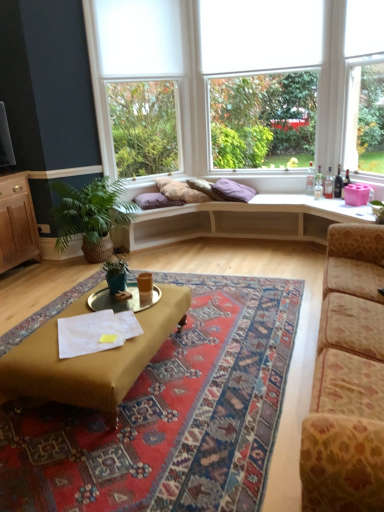
Question: Based on their sizes in the image, would you say green leafy plant at left, the first houseplant in the back-to-front sequence, is bigger or smaller than leopard print fabric couch at right?

Choices:
 (A) big
 (B) small

Answer: (B)

Question: Considering the positions of green leafy plant at left, which is counted as the 2th houseplant, starting from the front, and leopard print fabric couch at right in the image, is green leafy plant at left, which is counted as the 2th houseplant, starting from the front, wider or thinner than leopard print fabric couch at right?

Choices:
 (A) thin
 (B) wide

Answer: (B)

Question: Which is farther from the purple cotton pillow at center, which is the 2th pillow from left to right?

Choices:
 (A) carpeted rug at center
 (B) mustard fabric coffee table at center
 (C) leopard print fabric couch at right
 (D) metallic gold cocktail table at center
 (E) green matte plant at center, which is the 2th houseplant in back-to-front order

Answer: (B)

Question: Based on their relative distances, which object is nearer to the green leafy plant at left, which is counted as the 2th houseplant, starting from the front?

Choices:
 (A) white fabric blind at upper center
 (B) light wood futon at center
 (C) purple cotton pillow at center, which is the 2th pillow from left to right
 (D) wooden cabinet at left
 (E) green matte plant at center, acting as the first houseplant starting from the front

Answer: (D)